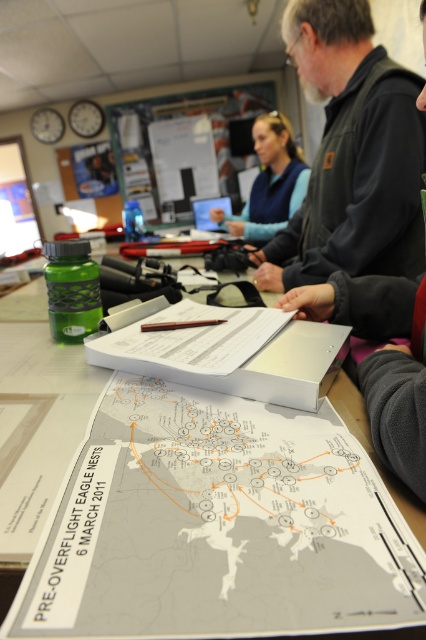
Question: Which is farther from the gray fleece jacket at upper center?

Choices:
 (A) white paper map at center
 (B) blue fleece vest at center

Answer: (B)

Question: Considering the relative positions of white paper map at center and gray fleece jacket at upper center in the image provided, where is white paper map at center located with respect to gray fleece jacket at upper center?

Choices:
 (A) above
 (B) below

Answer: (B)

Question: Estimate the real-world distances between objects in this image. Which object is farther from the gray fleece jacket at upper center?

Choices:
 (A) white paper map at center
 (B) blue fleece vest at center

Answer: (B)

Question: Is gray fleece jacket at upper center wider than blue fleece vest at center?

Choices:
 (A) no
 (B) yes

Answer: (A)

Question: Which point is closer to the camera?

Choices:
 (A) pyautogui.click(x=388, y=138)
 (B) pyautogui.click(x=268, y=499)
 (C) pyautogui.click(x=244, y=230)

Answer: (B)

Question: Is gray fleece jacket at upper center to the left of blue fleece vest at center from the viewer's perspective?

Choices:
 (A) no
 (B) yes

Answer: (A)